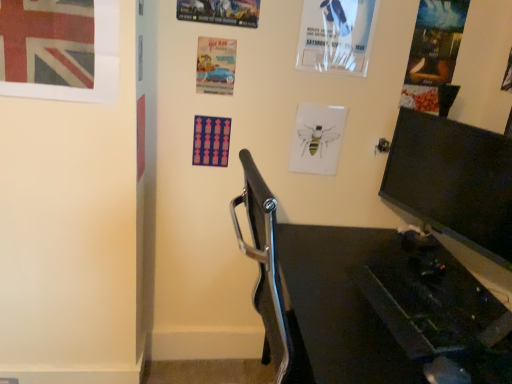
Question: Is white paper poster at upper center, the 5th poster page from the left, taller or shorter than matte paper poster at upper right, the 6th poster page viewed from the left?

Choices:
 (A) short
 (B) tall

Answer: (A)

Question: From a real-world perspective, is white paper poster at upper center, acting as the second poster page starting from the right, physically located above or below matte paper poster at upper right, which is counted as the first poster page, starting from the right?

Choices:
 (A) below
 (B) above

Answer: (B)

Question: Considering the real-world distances, which object is closest to the blue glossy car at center, marked as the second poster page in a left-to-right arrangement?

Choices:
 (A) white paper poster at upper center, the 5th poster page from the left
 (B) watercolor bee at center, the 3th poster page in the right-to-left sequence
 (C) union jack flag at upper left
 (D) metallic silver car at upper center, the 3th poster page when ordered from left to right
 (E) black plastic desk at lower right

Answer: (D)

Question: Considering the real-world distances, which object is farthest from the watercolor bee at center, the 3th poster page in the right-to-left sequence?

Choices:
 (A) matte paper poster at upper right, which is counted as the first poster page, starting from the right
 (B) white paper poster at upper center, the 5th poster page from the left
 (C) matte plastic poster at center, the first poster page when ordered from left to right
 (D) blue glossy car at center, marked as the second poster page in a left-to-right arrangement
 (E) black plastic desk at lower right

Answer: (E)